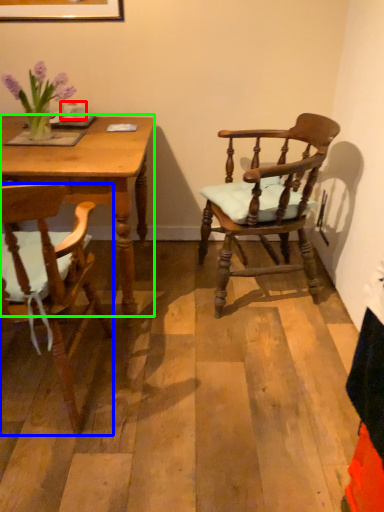
Question: Estimate the real-world distances between objects in this image. Which object is closer to coffee cup (highlighted by a red box), chair (highlighted by a blue box) or desk (highlighted by a green box)?

Choices:
 (A) chair
 (B) desk

Answer: (B)